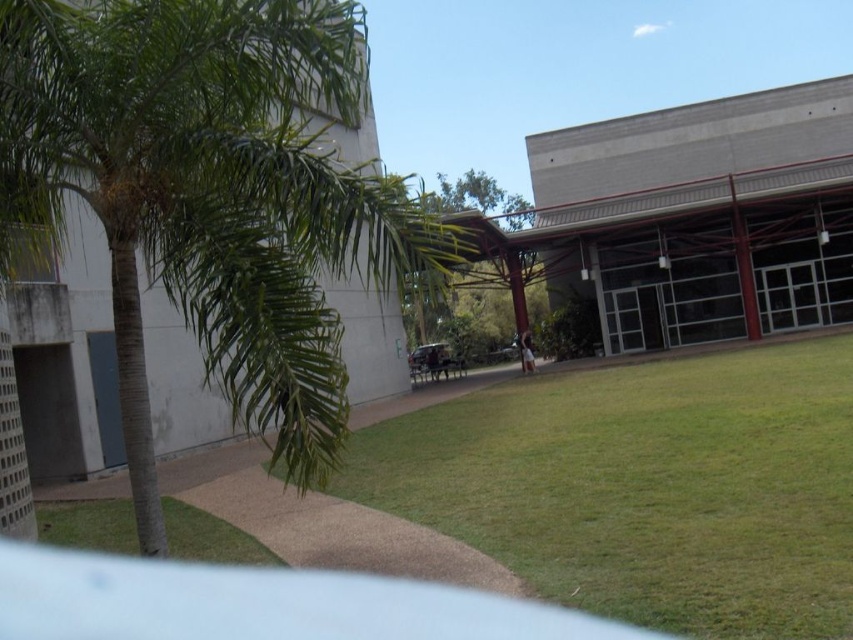
You are standing at the point marked as point (210, 196) in the image. What is the nearest object to you in the scene?

The nearest object to you at point (210, 196) is the green leafy palm tree at left, as the point is located on it.